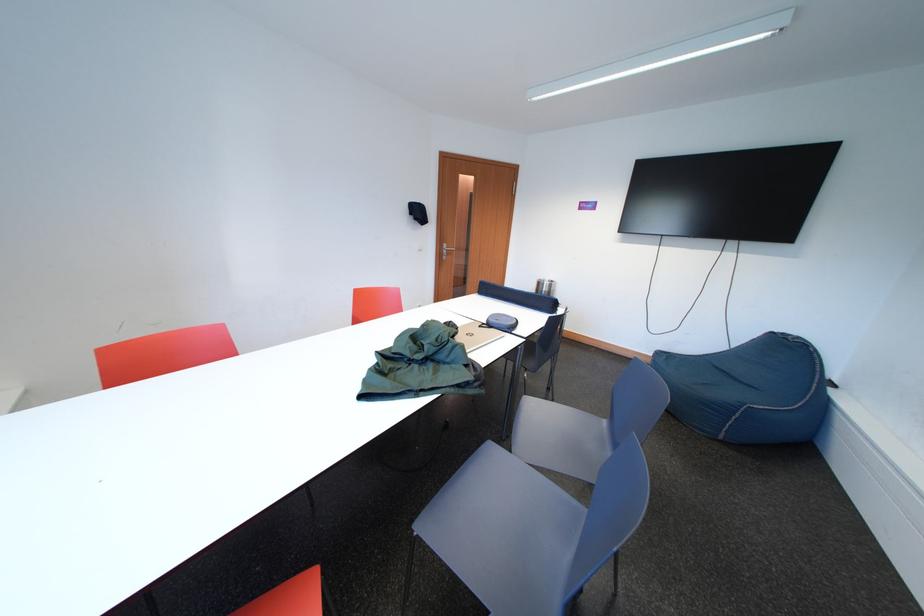
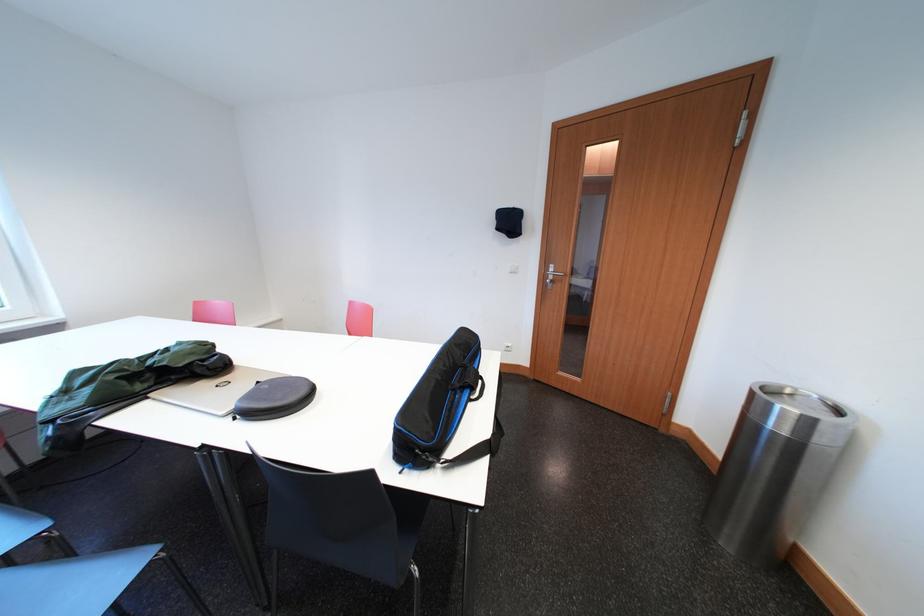
Where in the second image is the point corresponding to the point at 424,223 from the first image?

(506, 233)